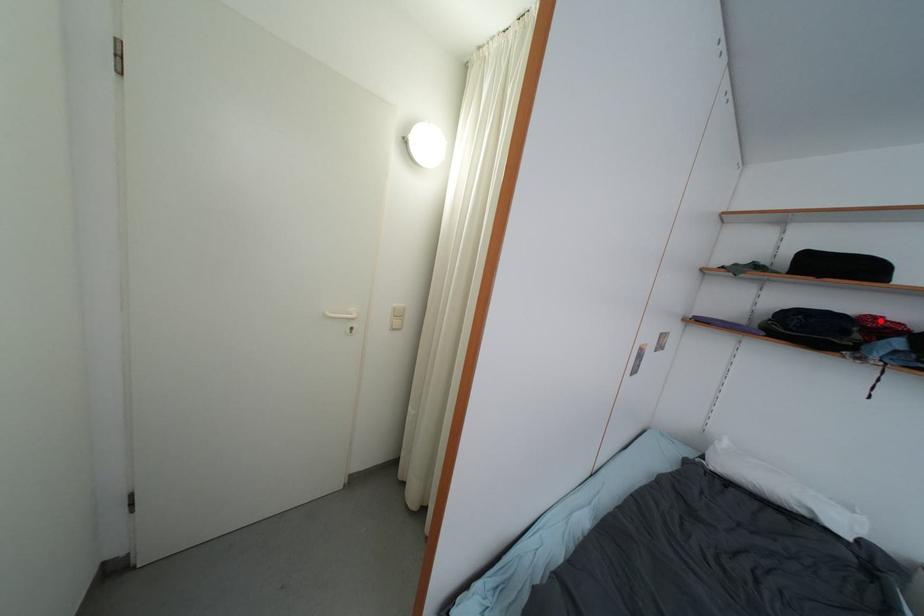
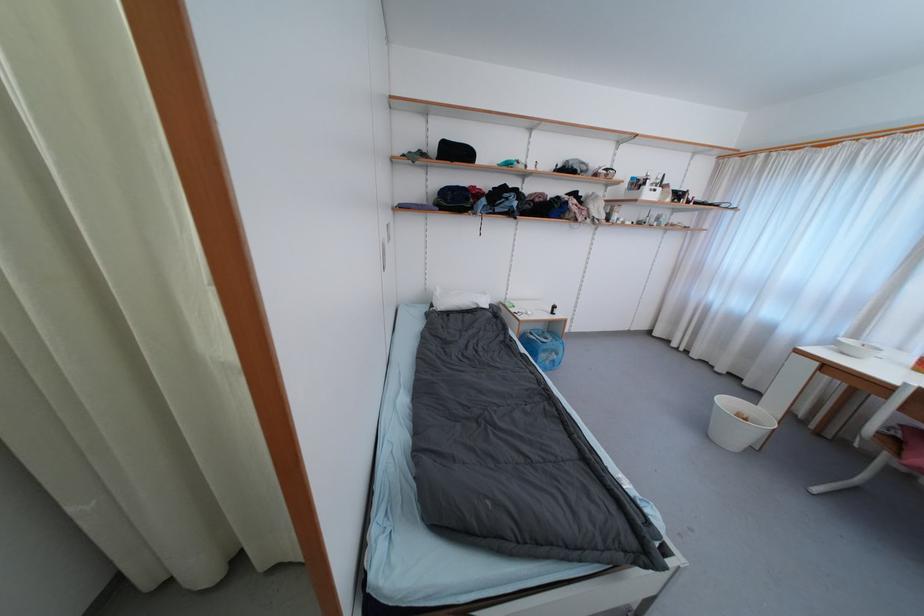
The point at the highlighted location is marked in the first image. Where is the corresponding point in the second image?

(478, 190)